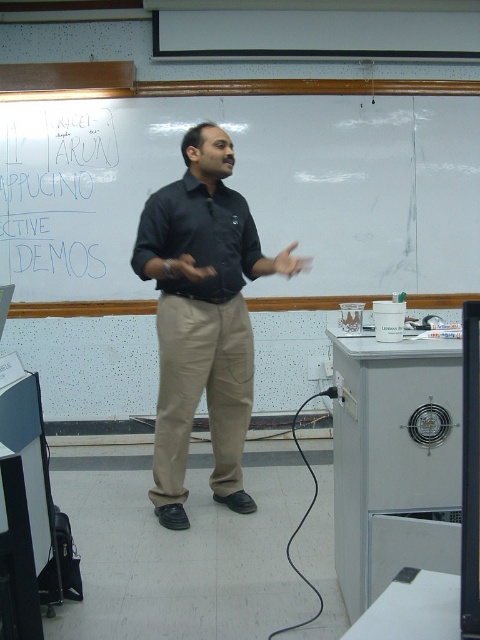
You are a student sitting in the classroom and need to write a note about the presentation. Which object, the whiteboard at upper center or the black matte shirt at center, has a larger width?

The whiteboard at upper center has a larger width than the black matte shirt at center.

You are a student sitting in the classroom and notice two black shirts worn by the presenter. The first is labeled as black shirt at center and the second as black matte shirt at center. Since both are black, how can you tell them apart based on their position?

The black shirt at center is 12.63 centimeters away from the black matte shirt at center, so you can distinguish them by their distance apart.

Where is the black shirt at center located in the image?

The black shirt at center is located at point (x=203, y=317).